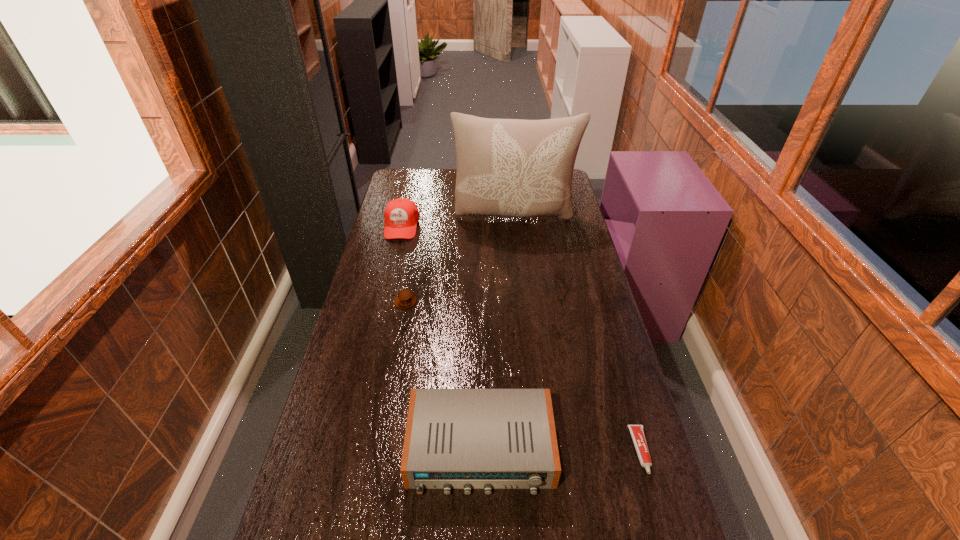
I want to click on baseball cap positioned at the left edge, so click(401, 215).

Find the location of a particular element. This screenshot has width=960, height=540. muffin present at the left edge is located at coordinates (405, 299).

The width and height of the screenshot is (960, 540). I want to click on cushion located at the right edge, so click(x=518, y=168).

The image size is (960, 540). In order to click on toothpaste that is at the right edge in this screenshot , I will do `click(637, 431)`.

In the image, there is a desktop. What are the coordinates of `vacant space at the far edge` in the screenshot? It's located at (445, 181).

In order to click on free space at the left edge of the desktop in this screenshot , I will do `click(396, 254)`.

The height and width of the screenshot is (540, 960). In the image, there is a desktop. Identify the location of blank space at the right edge. (583, 262).

Identify the location of vacant point located between the third tallest object and the shortest object. (561, 450).

I want to click on unoccupied position between the muffin and the tallest object, so click(460, 259).

Identify the location of free space between the second shortest object and the cushion. (460, 259).